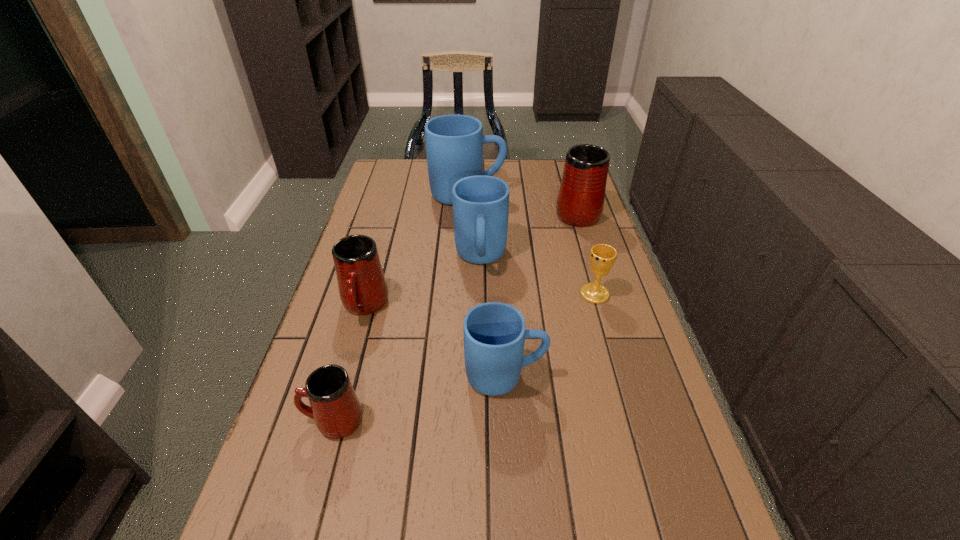
The width and height of the screenshot is (960, 540). What are the coordinates of `the nearest object` in the screenshot? It's located at (335, 407).

In order to click on the nearest red mug in this screenshot , I will do `click(335, 407)`.

Identify the location of blank area located on the side of the farthest blue mug with the handle. (533, 194).

Where is `vacant space situated 0.170m on the side of the rightmost mug with the handle`? The image size is (960, 540). vacant space situated 0.170m on the side of the rightmost mug with the handle is located at coordinates click(565, 173).

Where is `vacant region located 0.160m on the side of the rightmost mug with the handle`? The image size is (960, 540). vacant region located 0.160m on the side of the rightmost mug with the handle is located at coordinates (565, 174).

The width and height of the screenshot is (960, 540). I want to click on blank area located on the side of the rightmost mug with the handle, so click(x=567, y=179).

Find the location of a particular element. vacant space located 0.290m on the side of the second nearest blue mug with the handle is located at coordinates (481, 368).

You are a GUI agent. You are given a task and a screenshot of the screen. Output one action in this format:
    pyautogui.click(x=<x>, y=<y>)
    Task: Click on the blank space located on the side of the fourth farthest mug with the handle
    The image size is (960, 540).
    Given the screenshot: What is the action you would take?
    pyautogui.click(x=320, y=468)

The height and width of the screenshot is (540, 960). Identify the location of free point located 0.250m on the side of the nearest blue mug with the handle. (657, 376).

In order to click on free space located on the back of the gold chalice in this screenshot , I will do `click(581, 247)`.